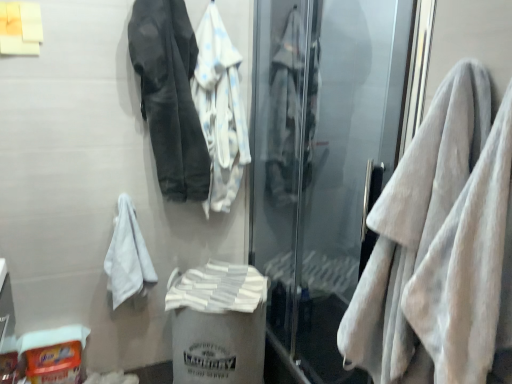
Question: Considering the positions of white soft bath towel at center and dark gray fabric jacket at upper left, the 1th jacket viewed from the left, in the image, is white soft bath towel at center wider or thinner than dark gray fabric jacket at upper left, the 1th jacket viewed from the left,?

Choices:
 (A) thin
 (B) wide

Answer: (B)

Question: From a real-world perspective, relative to dark gray fabric jacket at upper left, the second jacket positioned from the right, is white soft bath towel at center vertically above or below?

Choices:
 (A) above
 (B) below

Answer: (B)

Question: Which is farther from the dark gray fabric jacket at upper left, the 1th jacket viewed from the left?

Choices:
 (A) white plastic bag at center, arranged as the second garbage when viewed from the left
 (B) white soft towel at left, marked as the 2th towel in a right-to-left arrangement
 (C) white cotton jacket at upper center, the first jacket in the right-to-left sequence
 (D) white fluffy towel at right, positioned as the 1th towel in right-to-left order
 (E) transparent glass screen door at right

Answer: (D)

Question: Which object is the farthest from the white fluffy towel at right, the second towel viewed from the left?

Choices:
 (A) transparent glass screen door at right
 (B) white plastic bag at center, positioned as the 1th garbage in right-to-left order
 (C) white cotton towel at center
 (D) dark gray fabric jacket at upper left, the 1th jacket viewed from the left
 (E) white soft bath towel at center

Answer: (D)